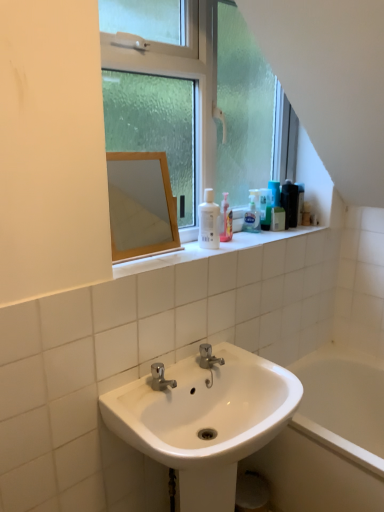
Question: Is wooden frame mirror at upper center completely or partially inside green matte bottle at upper right, the 3th mouthwash when ordered from right to left?

Choices:
 (A) no
 (B) yes

Answer: (A)

Question: Can you confirm if green matte bottle at upper right, the 3th mouthwash in the left-to-right sequence, is wider than wooden frame mirror at upper center?

Choices:
 (A) yes
 (B) no

Answer: (B)

Question: From the image's perspective, is green matte bottle at upper right, the 3th mouthwash in the left-to-right sequence, on wooden frame mirror at upper center?

Choices:
 (A) no
 (B) yes

Answer: (A)

Question: Are green matte bottle at upper right, the 3th mouthwash when ordered from right to left, and wooden frame mirror at upper center beside each other?

Choices:
 (A) yes
 (B) no

Answer: (B)

Question: Can you confirm if green matte bottle at upper right, the 3th mouthwash in the left-to-right sequence, is positioned to the right of wooden frame mirror at upper center?

Choices:
 (A) yes
 (B) no

Answer: (A)

Question: Can you confirm if green matte bottle at upper right, positioned as the second mouthwash in front-to-back order, is positioned to the left of wooden frame mirror at upper center?

Choices:
 (A) no
 (B) yes

Answer: (A)

Question: Considering the relative sizes of green matte bottle at upper right, which is counted as the second mouthwash, starting from the left, and white glossy sink at lower center in the image provided, is green matte bottle at upper right, which is counted as the second mouthwash, starting from the left, thinner than white glossy sink at lower center?

Choices:
 (A) no
 (B) yes

Answer: (B)

Question: Considering the relative sizes of green matte bottle at upper right, the 3th mouthwash when ordered from back to front, and white glossy sink at lower center in the image provided, is green matte bottle at upper right, the 3th mouthwash when ordered from back to front, taller than white glossy sink at lower center?

Choices:
 (A) yes
 (B) no

Answer: (B)

Question: Can you confirm if green matte bottle at upper right, the 3th mouthwash when ordered from back to front, is positioned to the left of white glossy sink at lower center?

Choices:
 (A) yes
 (B) no

Answer: (B)

Question: Is green matte bottle at upper right, which is counted as the second mouthwash, starting from the left, touching white glossy sink at lower center?

Choices:
 (A) no
 (B) yes

Answer: (A)

Question: Is green matte bottle at upper right, the 3th mouthwash when ordered from back to front, positioned before white glossy sink at lower center?

Choices:
 (A) no
 (B) yes

Answer: (A)

Question: Can you confirm if green matte bottle at upper right, positioned as the fourth mouthwash in right-to-left order, is positioned to the right of white glossy sink at lower center?

Choices:
 (A) no
 (B) yes

Answer: (B)

Question: From the image's perspective, is black plastic mouthwash at upper right, the 5th mouthwash viewed from the left, beneath green matte bottle at upper right, the 3th mouthwash when ordered from right to left?

Choices:
 (A) no
 (B) yes

Answer: (A)